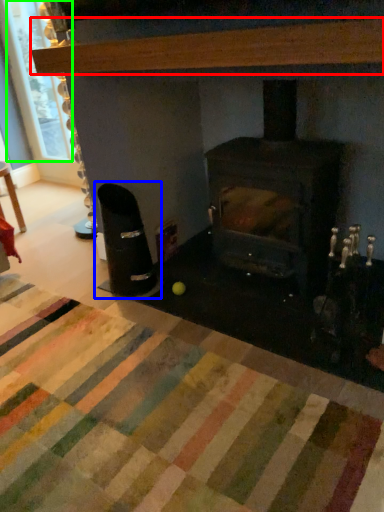
Question: Which is farther away from hardwood (highlighted by a red box)? armchair (highlighted by a blue box) or window screen (highlighted by a green box)?

Choices:
 (A) armchair
 (B) window screen

Answer: (B)